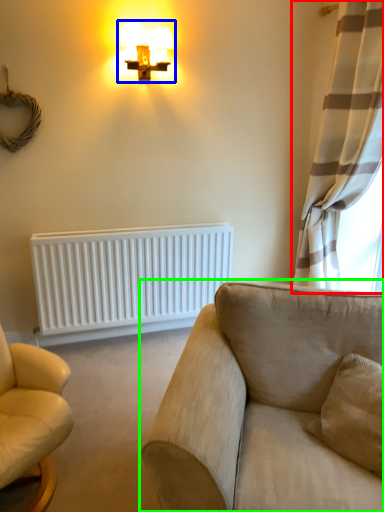
Question: Which is farther away from curtain (highlighted by a red box)? lamp (highlighted by a blue box) or studio couch (highlighted by a green box)?

Choices:
 (A) lamp
 (B) studio couch

Answer: (B)